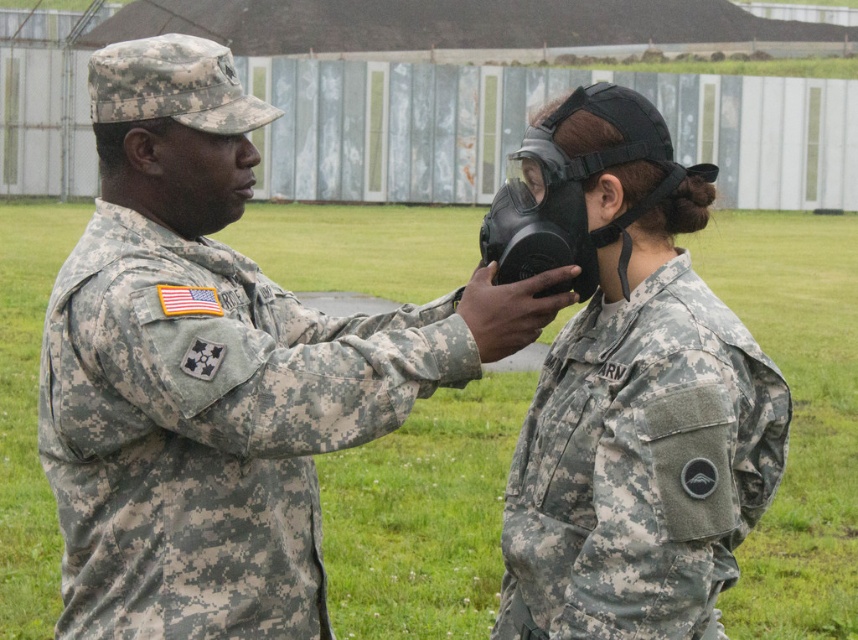
You are a military recruit observing the scene. The camouflage uniform at left is demonstrating something to the matte black mask at center. Which object is taller?

The camouflage uniform at left is taller than the matte black mask at center.